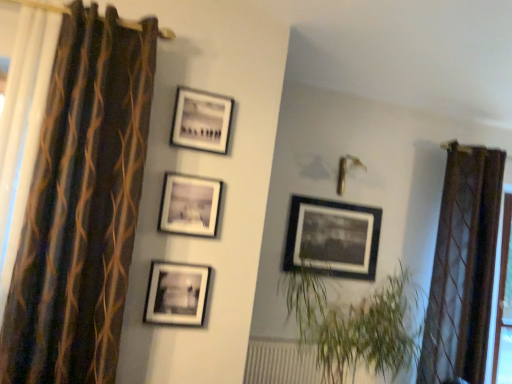
Question: From the image's perspective, does matte black picture frame at center, which is counted as the 3th picture frame, starting from the right, appear higher than brown sheer curtain at right, which is the 2th curtain in left-to-right order?

Choices:
 (A) no
 (B) yes

Answer: (B)

Question: Is matte black picture frame at center, which is counted as the 3th picture frame, starting from the right, facing towards brown sheer curtain at right, arranged as the 2th curtain when viewed from the front?

Choices:
 (A) no
 (B) yes

Answer: (A)

Question: Can you confirm if matte black picture frame at center, which is the second picture frame from front to back, is taller than brown sheer curtain at right, positioned as the first curtain in right-to-left order?

Choices:
 (A) no
 (B) yes

Answer: (A)

Question: Is matte black picture frame at center, which is the 2th picture frame in left-to-right order, to the right of brown sheer curtain at right, which is the 2th curtain in left-to-right order, from the viewer's perspective?

Choices:
 (A) yes
 (B) no

Answer: (B)

Question: Is matte black picture frame at center, the 3th picture frame when ordered from back to front, closer to camera compared to brown sheer curtain at right, arranged as the 2th curtain when viewed from the front?

Choices:
 (A) yes
 (B) no

Answer: (A)

Question: Is matte black picture frame at center, which is the 2th picture frame in left-to-right order, wider or thinner than brown striped curtain at left, the second curtain positioned from the back?

Choices:
 (A) thin
 (B) wide

Answer: (A)

Question: From the image's perspective, is matte black picture frame at center, which is the second picture frame from front to back, above or below brown striped curtain at left, the second curtain positioned from the back?

Choices:
 (A) below
 (B) above

Answer: (A)

Question: Based on their positions, is matte black picture frame at center, which is the 2th picture frame in left-to-right order, located to the left or right of brown striped curtain at left, which is counted as the second curtain, starting from the right?

Choices:
 (A) right
 (B) left

Answer: (A)

Question: Is point (170, 190) closer or farther from the camera than point (141, 155)?

Choices:
 (A) closer
 (B) farther

Answer: (B)

Question: Is green leafy plant at center spatially inside matte black picture frame at center, which is the second picture frame from front to back, or outside of it?

Choices:
 (A) outside
 (B) inside

Answer: (A)

Question: Does point (393, 288) appear closer or farther from the camera than point (185, 175)?

Choices:
 (A) farther
 (B) closer

Answer: (A)

Question: From the image's perspective, is green leafy plant at center above or below matte black picture frame at center, which is counted as the 3th picture frame, starting from the right?

Choices:
 (A) below
 (B) above

Answer: (A)

Question: From a real-world perspective, is green leafy plant at center physically located above or below matte black picture frame at center, which is the 2th picture frame in left-to-right order?

Choices:
 (A) above
 (B) below

Answer: (B)

Question: From a real-world perspective, relative to matte black picture frame at center, which is the 2th picture frame in left-to-right order, is brown striped curtain at left, which is counted as the second curtain, starting from the right, vertically above or below?

Choices:
 (A) below
 (B) above

Answer: (A)

Question: Is brown striped curtain at left, positioned as the first curtain in front-to-back order, wider or thinner than matte black picture frame at center, which is the 2th picture frame in left-to-right order?

Choices:
 (A) wide
 (B) thin

Answer: (A)